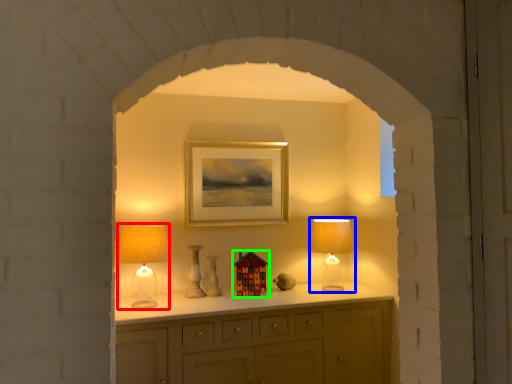
Question: Which object is positioned closest to table lamp (highlighted by a red box)? Select from table lamp (highlighted by a blue box) and toy (highlighted by a green box).

Choices:
 (A) table lamp
 (B) toy

Answer: (B)